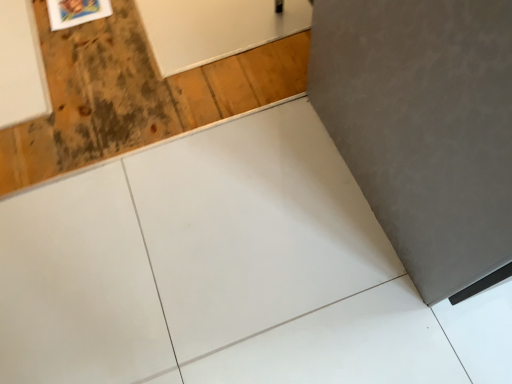
At what (x,y) coordinates should I click in order to perform the action: click on blank space above wooden frame at upper left (from a real-world perspective). Please return your answer as a coordinate pair (x, y). Image resolution: width=512 pixels, height=384 pixels. Looking at the image, I should click on (77, 8).